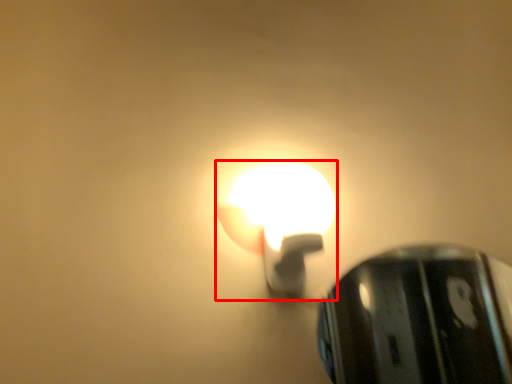
Question: From the image's perspective, what is the correct spatial relationship of lamp (annotated by the red box) in relation to lamp?

Choices:
 (A) below
 (B) above

Answer: (B)